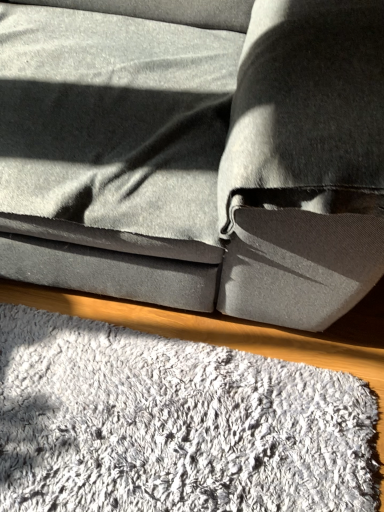
Question: Can you confirm if suede gray couch at center is thinner than white fluffy mat at lower center?

Choices:
 (A) yes
 (B) no

Answer: (B)

Question: Is suede gray couch at center behind white fluffy mat at lower center?

Choices:
 (A) no
 (B) yes

Answer: (A)

Question: From the image's perspective, would you say suede gray couch at center is shown under white fluffy mat at lower center?

Choices:
 (A) yes
 (B) no

Answer: (B)

Question: Can you confirm if suede gray couch at center is wider than white fluffy mat at lower center?

Choices:
 (A) no
 (B) yes

Answer: (B)

Question: Is suede gray couch at center located outside white fluffy mat at lower center?

Choices:
 (A) no
 (B) yes

Answer: (B)

Question: Is suede gray couch at center at the right side of white fluffy mat at lower center?

Choices:
 (A) yes
 (B) no

Answer: (B)

Question: Is white fluffy mat at lower center outside suede gray couch at center?

Choices:
 (A) yes
 (B) no

Answer: (A)

Question: Is white fluffy mat at lower center positioned with its back to suede gray couch at center?

Choices:
 (A) yes
 (B) no

Answer: (B)

Question: Is the surface of white fluffy mat at lower center in direct contact with suede gray couch at center?

Choices:
 (A) no
 (B) yes

Answer: (A)

Question: Is white fluffy mat at lower center behind suede gray couch at center?

Choices:
 (A) yes
 (B) no

Answer: (A)

Question: From the image's perspective, is white fluffy mat at lower center located above suede gray couch at center?

Choices:
 (A) yes
 (B) no

Answer: (B)

Question: From the image's perspective, does white fluffy mat at lower center appear lower than suede gray couch at center?

Choices:
 (A) yes
 (B) no

Answer: (A)

Question: Is white fluffy mat at lower center in front of or behind suede gray couch at center in the image?

Choices:
 (A) front
 (B) behind

Answer: (B)